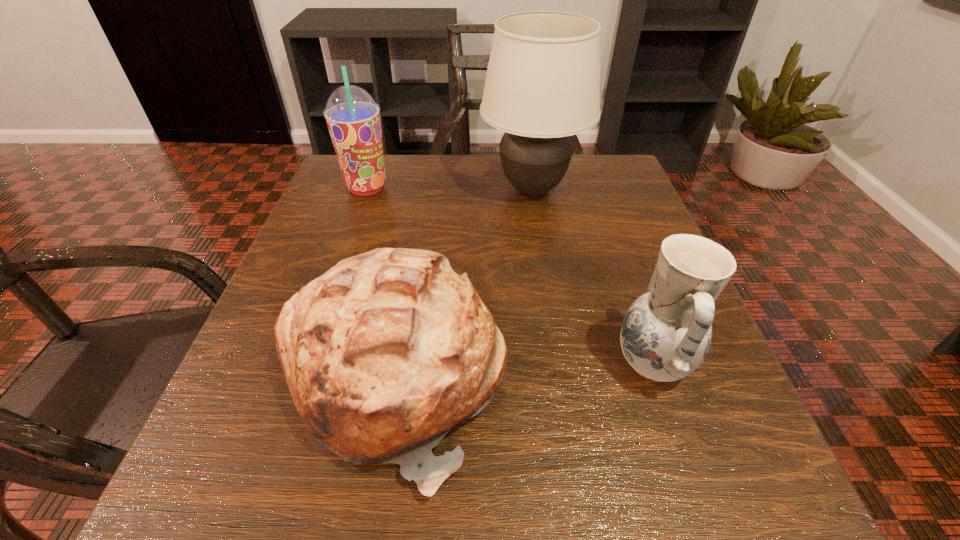
This screenshot has width=960, height=540. I want to click on vacant space in between the smoothie and the pottery, so click(x=510, y=275).

Locate an element on the screen. This screenshot has width=960, height=540. unoccupied position between the pottery and the tallest object is located at coordinates (592, 276).

Locate an element on the screen. This screenshot has height=540, width=960. blank region between the smoothie and the lampshade is located at coordinates (449, 189).

This screenshot has height=540, width=960. Identify the location of vacant space in between the pottery and the smoothie. coord(510,275).

Image resolution: width=960 pixels, height=540 pixels. In order to click on object that is the second closest to the shortest object in this screenshot , I will do `click(542, 86)`.

Choose which object is the third nearest neighbor to the second tallest object. Please provide its 2D coordinates. Your answer should be formatted as a tuple, i.e. [(x, y)], where the tuple contains the x and y coordinates of a point satisfying the conditions above.

[(666, 333)]

Identify the location of vacant region that satisfies the following two spatial constraints: 1. on the back side of the bread; 2. on the left side of the lampshade. The image size is (960, 540). (426, 190).

This screenshot has width=960, height=540. What are the coordinates of `vacant space that satisfies the following two spatial constraints: 1. on the back side of the lampshade; 2. on the right side of the shortest object` in the screenshot? It's located at (426, 190).

You are a GUI agent. You are given a task and a screenshot of the screen. Output one action in this format:
    pyautogui.click(x=<x>, y=<y>)
    Task: Click on the vacant space that satisfies the following two spatial constraints: 1. on the back side of the shortest object; 2. on the right side of the tallest object
    This screenshot has width=960, height=540.
    Given the screenshot: What is the action you would take?
    pyautogui.click(x=426, y=190)